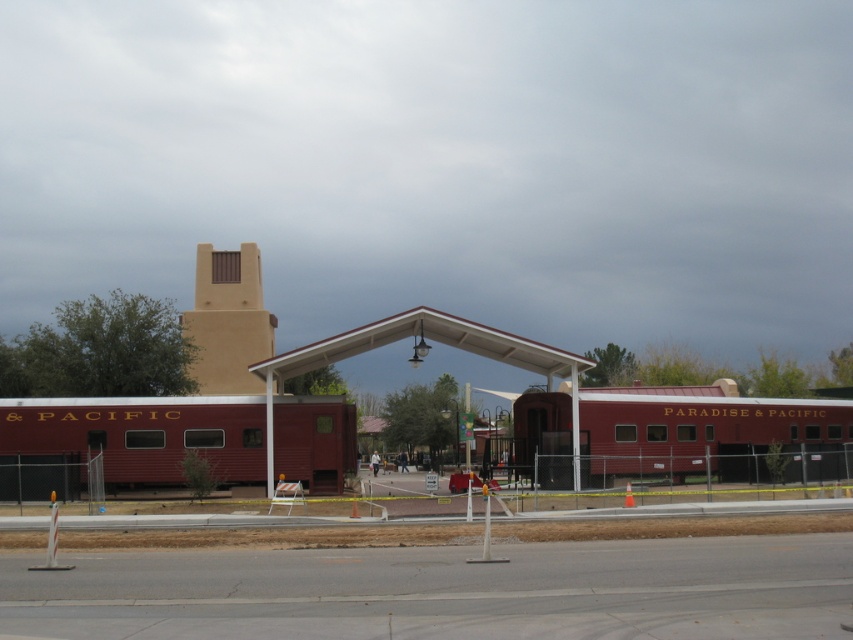
You are a visitor at the train station. You see the matte red train car at center and the white matte railway station at center. Which one is closer to you?

The matte red train car at center is closer to you because it is in front of the white matte railway station at center.

You are a visitor at the train station and want to take a photo of the matte red train car at center and the white matte railway station at center. Which object should you position yourself to the right of to capture both in the frame?

You should position yourself to the right of the white matte railway station at center because the matte red train car at center is to the left of it, allowing both objects to be included in the photo frame.